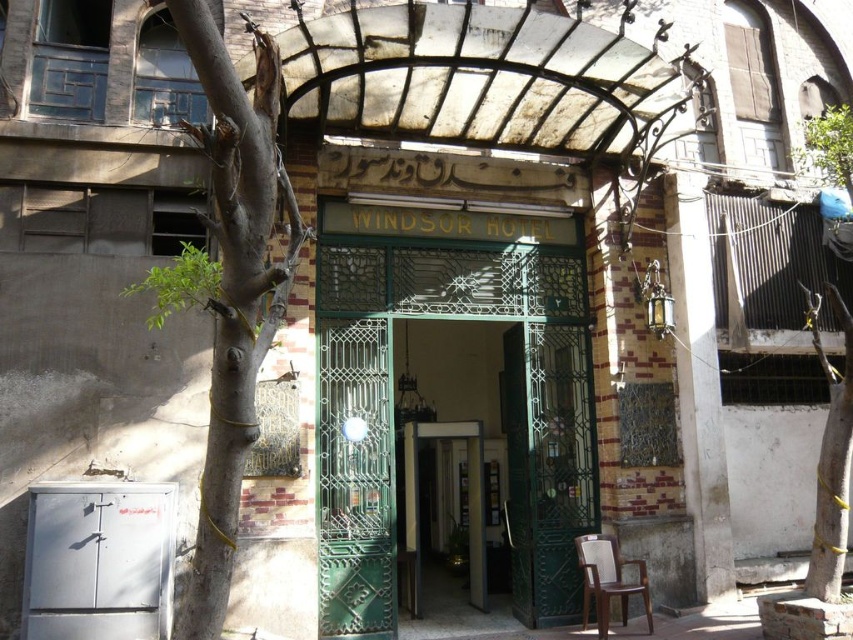
Question: Does gray bark tree at left have a larger size compared to brown wooden chair at lower right?

Choices:
 (A) no
 (B) yes

Answer: (B)

Question: Does green metal gate at center have a greater width compared to brown wooden chair at lower right?

Choices:
 (A) yes
 (B) no

Answer: (A)

Question: Which of these objects is positioned closest to the brown wooden chair at lower right?

Choices:
 (A) green textured bark at right
 (B) gray bark tree at left

Answer: (A)

Question: Which of the following is the farthest from the observer?

Choices:
 (A) pos(817,552)
 (B) pos(247,216)

Answer: (A)

Question: Does green metal gate at center appear on the left side of gray bark tree at left?

Choices:
 (A) no
 (B) yes

Answer: (A)

Question: Which of the following is the farthest from the observer?

Choices:
 (A) gray bark tree at left
 (B) brown wooden chair at lower right
 (C) green metal gate at center

Answer: (C)